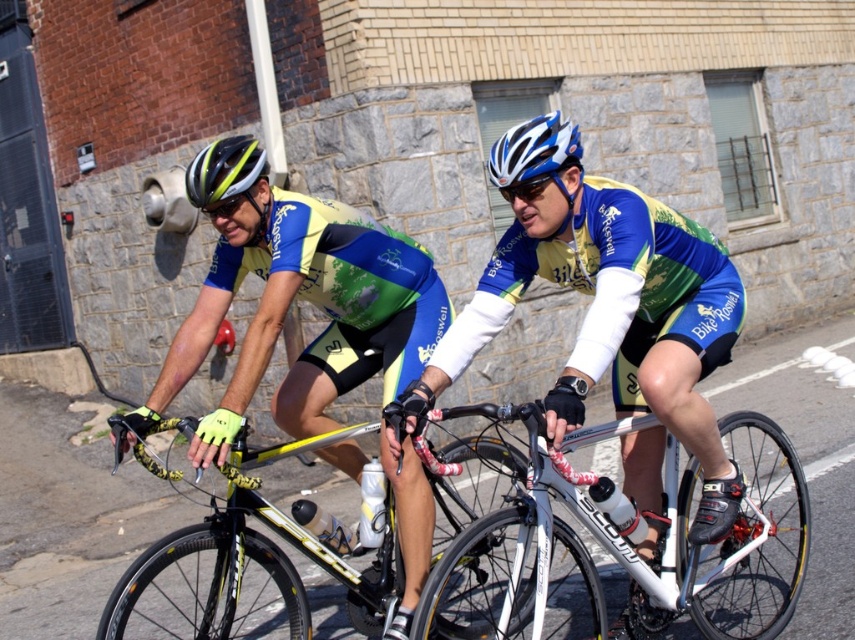
Question: Which object is positioned farthest from the yellow/glossy bicycle at center?

Choices:
 (A) shiny blue helmet at center
 (B) white metallic bicycle at center
 (C) yellow-green jersey at center
 (D) blue glossy bicycle helmet at upper center

Answer: (D)

Question: Among these points, which one is farthest from the camera?

Choices:
 (A) (417, 412)
 (B) (360, 248)

Answer: (B)

Question: Is matte blue cycling jersey at center to the right of yellow-green jersey at center from the viewer's perspective?

Choices:
 (A) no
 (B) yes

Answer: (B)

Question: Which object appears farthest from the camera in this image?

Choices:
 (A) matte blue cycling jersey at center
 (B) yellow-green jersey at center
 (C) blue glossy bicycle helmet at upper center
 (D) white metallic bicycle at center

Answer: (C)

Question: Is white metallic bicycle at center further to camera compared to shiny blue helmet at center?

Choices:
 (A) no
 (B) yes

Answer: (A)

Question: Does yellow-green jersey at center appear over blue glossy bicycle helmet at upper center?

Choices:
 (A) no
 (B) yes

Answer: (A)